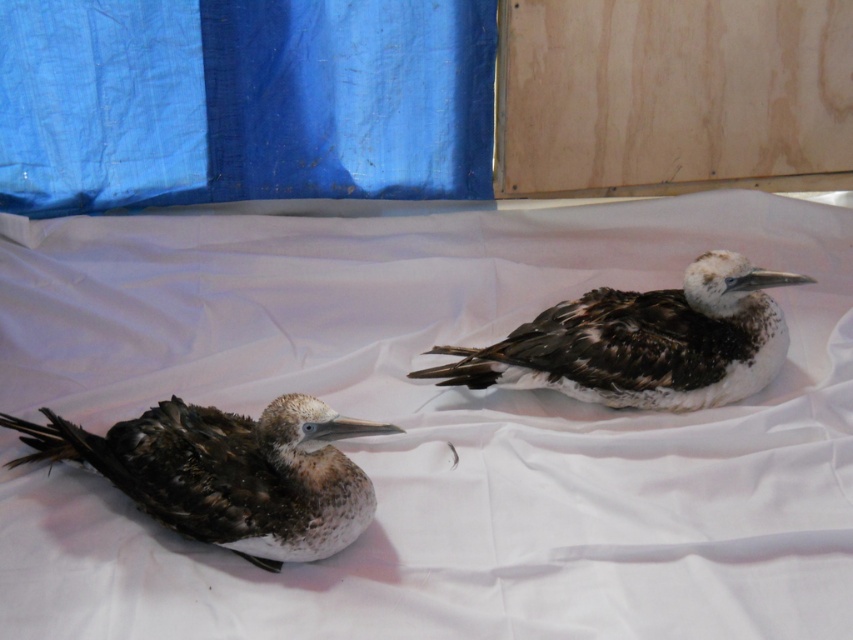
Does blue fabric curtain at upper left have a lesser width compared to brown feathered bird at left?

No, blue fabric curtain at upper left is not thinner than brown feathered bird at left.

Can you confirm if blue fabric curtain at upper left is positioned to the right of brown feathered bird at left?

In fact, blue fabric curtain at upper left is to the left of brown feathered bird at left.

Between point (172, 29) and point (161, 467), which one is positioned behind?

Positioned behind is point (172, 29).

What are the coordinates of `blue fabric curtain at upper left` in the screenshot? It's located at (242, 100).

Locate an element on the screen. This screenshot has height=640, width=853. white fabric at center is located at coordinates (431, 426).

In the scene shown: Between white fabric at center and blue fabric curtain at upper left, which one has less height?

blue fabric curtain at upper left is shorter.

The height and width of the screenshot is (640, 853). I want to click on white fabric at center, so click(431, 426).

Locate an element on the screen. This screenshot has height=640, width=853. white fabric at center is located at coordinates (431, 426).

Can you confirm if white fabric at center is taller than brown speckled feathers at center?

Yes.

Who is higher up, white fabric at center or brown speckled feathers at center?

brown speckled feathers at center is higher up.

Image resolution: width=853 pixels, height=640 pixels. I want to click on white fabric at center, so [431, 426].